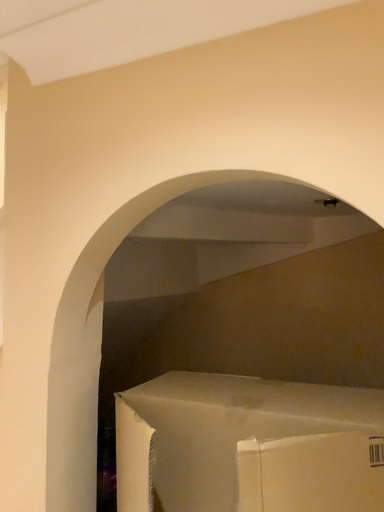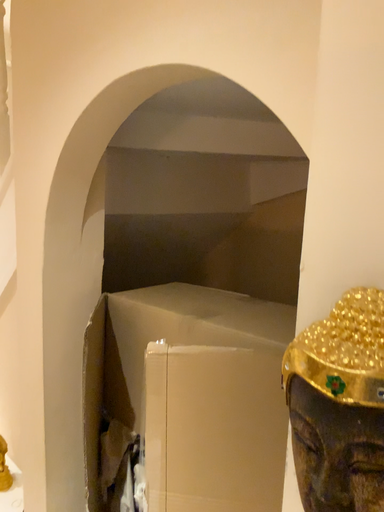
Question: How did the camera likely rotate when shooting the video?

Choices:
 (A) rotated downward
 (B) rotated upward

Answer: (A)